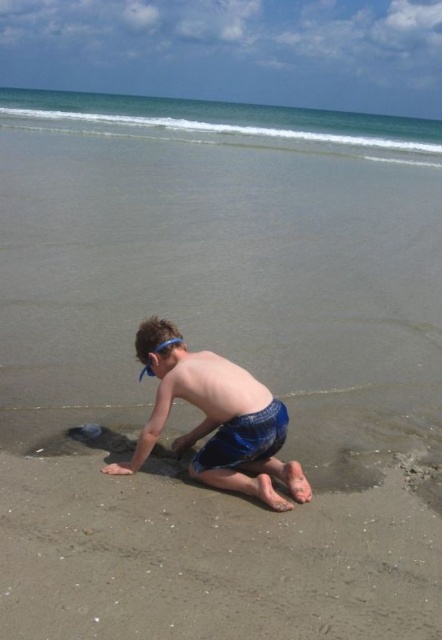
Based on the scene, which object takes up more area in the image between the sandy at lower center and the blue water at upper center?

The blue water at upper center occupies more area than the sandy at lower center.

The boy is playing on the beach. Based on the scene, can you determine if the blue water at upper center is above or below the blue fabric shorts at lower center?

The blue water at upper center is located above the blue fabric shorts at lower center.

You are a photographer standing at the shoreline. You want to capture a photo of the sandy at lower center and the blue fabric shorts at lower center. Which object will appear larger in the photo?

The sandy at lower center will appear larger in the photo because it is closer to the viewer than the blue fabric shorts at lower center.